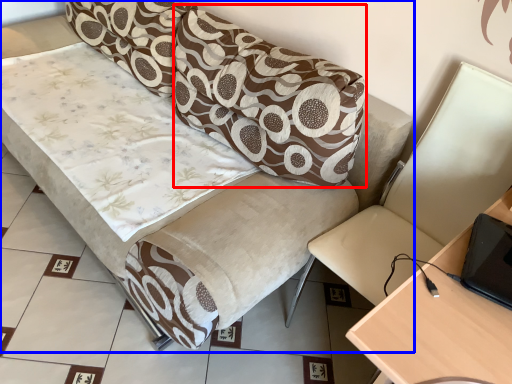
Question: Which object appears closest to the camera in this image, pillow (highlighted by a red box) or studio couch (highlighted by a blue box)?

Choices:
 (A) pillow
 (B) studio couch

Answer: (B)